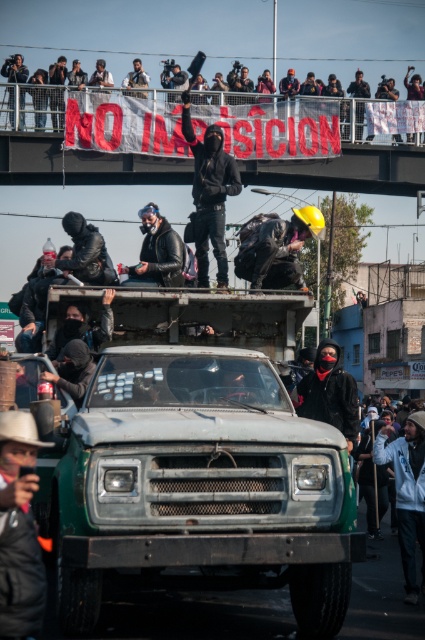
Question: Which is nearer to the black leather jacket at upper center?

Choices:
 (A) black matte jacket at center
 (B) brown leather hat at lower left
 (C) hard hat at center
 (D) black fabric banner at upper center

Answer: (D)

Question: Is black fabric banner at upper center bigger than matte black jacket at lower left?

Choices:
 (A) yes
 (B) no

Answer: (A)

Question: Among these objects, which one is nearest to the camera?

Choices:
 (A) matte black camera at upper center
 (B) black fabric banner at upper center

Answer: (B)

Question: Is white matte jacket at lower right further to the viewer compared to black matte jacket at center?

Choices:
 (A) no
 (B) yes

Answer: (B)

Question: Is black fabric banner at upper center positioned behind black leather jacket at upper center?

Choices:
 (A) no
 (B) yes

Answer: (A)

Question: Considering the real-world distances, which object is farthest from the black leather jacket at upper center?

Choices:
 (A) black matte jacket at center
 (B) brown leather hat at lower left

Answer: (B)